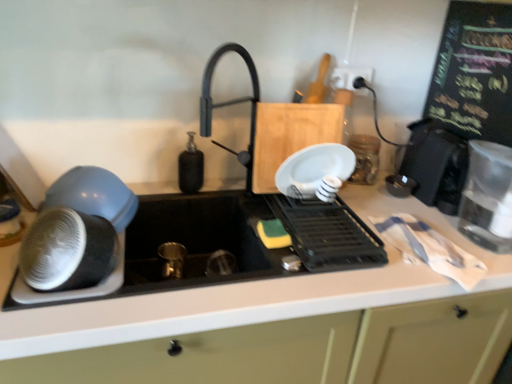
Question: Is the position of matte blue bowl at left, positioned as the second kitchen appliance in right-to-left order, less distant than that of clear glass water at right, acting as the first kitchen appliance starting from the right?

Choices:
 (A) yes
 (B) no

Answer: (B)

Question: Does matte blue bowl at left, the first kitchen appliance from the left, contain clear glass water at right, acting as the first kitchen appliance starting from the right?

Choices:
 (A) yes
 (B) no

Answer: (B)

Question: Could you tell me if matte blue bowl at left, the first kitchen appliance from the left, is turned towards clear glass water at right, the 2th kitchen appliance positioned from the left?

Choices:
 (A) yes
 (B) no

Answer: (A)

Question: Can you confirm if matte blue bowl at left, positioned as the second kitchen appliance in right-to-left order, is taller than clear glass water at right, the 2th kitchen appliance positioned from the left?

Choices:
 (A) yes
 (B) no

Answer: (B)

Question: Is matte blue bowl at left, the first kitchen appliance from the left, bigger than clear glass water at right, acting as the first kitchen appliance starting from the right?

Choices:
 (A) yes
 (B) no

Answer: (B)

Question: From the image's perspective, is matte blue bowl at left, positioned as the second kitchen appliance in right-to-left order, located above clear glass water at right, acting as the first kitchen appliance starting from the right?

Choices:
 (A) yes
 (B) no

Answer: (B)

Question: Is the position of matte blue bowl at left, positioned as the second kitchen appliance in right-to-left order, more distant than that of clear glass jar at upper right, which appears as the 3th appliance when viewed from the left?

Choices:
 (A) yes
 (B) no

Answer: (B)

Question: From the image's perspective, is matte blue bowl at left, the first kitchen appliance from the left, above clear glass jar at upper right, placed as the second appliance when sorted from right to left?

Choices:
 (A) no
 (B) yes

Answer: (A)

Question: Can you confirm if matte blue bowl at left, the first kitchen appliance from the left, is positioned to the right of clear glass jar at upper right, placed as the second appliance when sorted from right to left?

Choices:
 (A) yes
 (B) no

Answer: (B)

Question: Considering the relative sizes of matte blue bowl at left, the first kitchen appliance from the left, and clear glass jar at upper right, which appears as the 3th appliance when viewed from the left, in the image provided, is matte blue bowl at left, the first kitchen appliance from the left, shorter than clear glass jar at upper right, which appears as the 3th appliance when viewed from the left,?

Choices:
 (A) no
 (B) yes

Answer: (A)

Question: Does matte blue bowl at left, the first kitchen appliance from the left, have a greater width compared to clear glass jar at upper right, placed as the second appliance when sorted from right to left?

Choices:
 (A) no
 (B) yes

Answer: (B)

Question: Is matte blue bowl at left, the first kitchen appliance from the left, touching clear glass jar at upper right, which appears as the 3th appliance when viewed from the left?

Choices:
 (A) no
 (B) yes

Answer: (A)

Question: Would you consider black plastic dish rack at center, arranged as the third appliance when viewed from the right, to be distant from white plastic electric outlet at upper right?

Choices:
 (A) yes
 (B) no

Answer: (B)